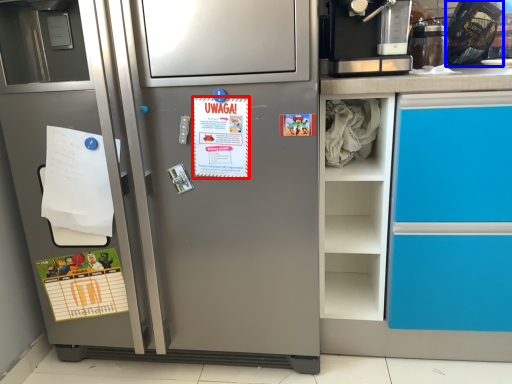
Question: Which of the following is the farthest to the observer, postcard (highlighted by a red box) or appliance (highlighted by a blue box)?

Choices:
 (A) postcard
 (B) appliance

Answer: (B)